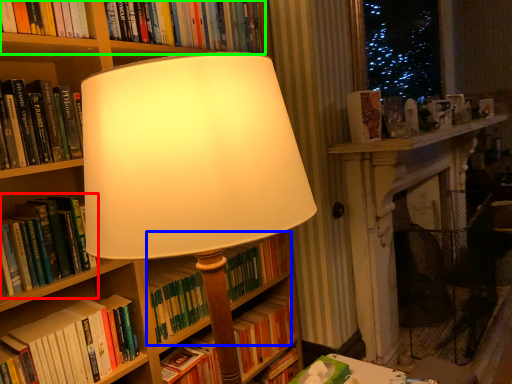
Question: Based on their relative distances, which object is nearer to book (highlighted by a red box)? Choose from book (highlighted by a blue box) and book (highlighted by a green box).

Choices:
 (A) book
 (B) book

Answer: (A)